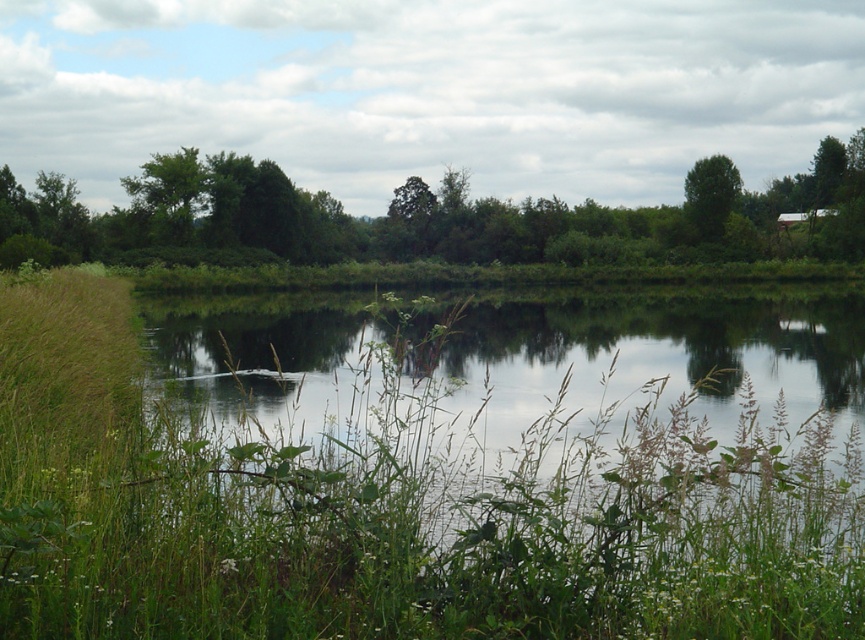
Question: Does green leafy tree at center have a lesser width compared to green leafy tree at upper right?

Choices:
 (A) no
 (B) yes

Answer: (A)

Question: Which of the following is the closest to the observer?

Choices:
 (A) (337, 320)
 (B) (763, 257)
 (C) (142, 204)
 (D) (702, 188)

Answer: (A)

Question: Is green leafy tree at center closer to camera compared to green leafy tree at upper right?

Choices:
 (A) yes
 (B) no

Answer: (A)

Question: Which point appears closest to the camera in this image?

Choices:
 (A) (178, 208)
 (B) (726, 164)
 (C) (849, 234)
 (D) (476, 435)

Answer: (D)

Question: Is green leafy tree at upper left further to the viewer compared to green leafy tree at upper right?

Choices:
 (A) no
 (B) yes

Answer: (A)

Question: Which point is closer to the camera taking this photo?

Choices:
 (A) pos(258,168)
 (B) pos(125,186)
 (C) pos(719,177)

Answer: (A)